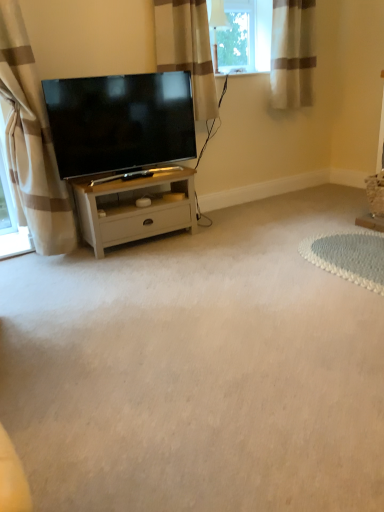
Question: In the image, is beige fabric curtain at upper center, the second curtain when ordered from left to right, positioned in front of or behind white wood cabinet at center?

Choices:
 (A) behind
 (B) front

Answer: (A)

Question: From a real-world perspective, is beige fabric curtain at upper center, the second curtain when ordered from left to right, physically located above or below white wood cabinet at center?

Choices:
 (A) above
 (B) below

Answer: (A)

Question: Estimate the real-world distances between objects in this image. Which object is farther from the beige striped curtain at upper right, which is the 1th curtain in right-to-left order?

Choices:
 (A) beige fabric curtain at upper center, the second curtain when ordered from left to right
 (B) beige striped curtain at left, the 1th curtain in the left-to-right sequence
 (C) white wood cabinet at center
 (D) matte black tv at center

Answer: (B)

Question: Considering the real-world distances, which object is closest to the beige striped curtain at upper right, which is counted as the 3th curtain, starting from the left?

Choices:
 (A) beige fabric curtain at upper center, the second curtain when ordered from right to left
 (B) matte black tv at center
 (C) beige striped curtain at left, the third curtain when ordered from right to left
 (D) white wood cabinet at center

Answer: (A)